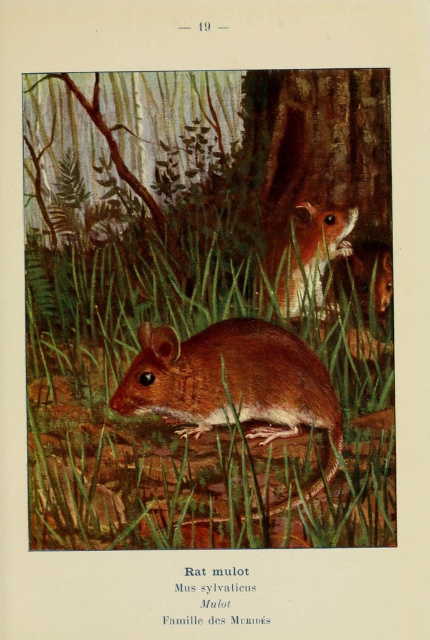
Question: Considering the real-world distances, which object is farthest from the brown furry mouse at center?

Choices:
 (A) brown furry mouse at upper right
 (B) green grass at center

Answer: (A)

Question: Which of the following is the farthest from the observer?

Choices:
 (A) brown furry mouse at upper right
 (B) green grass at center
 (C) brown furry mouse at center

Answer: (A)

Question: Does green grass at center appear under brown furry mouse at upper right?

Choices:
 (A) no
 (B) yes

Answer: (B)

Question: Is green grass at center below brown furry mouse at center?

Choices:
 (A) no
 (B) yes

Answer: (A)

Question: Does green grass at center have a larger size compared to brown furry mouse at center?

Choices:
 (A) yes
 (B) no

Answer: (A)

Question: Among these objects, which one is nearest to the camera?

Choices:
 (A) brown furry mouse at upper right
 (B) green grass at center
 (C) brown furry mouse at center

Answer: (B)